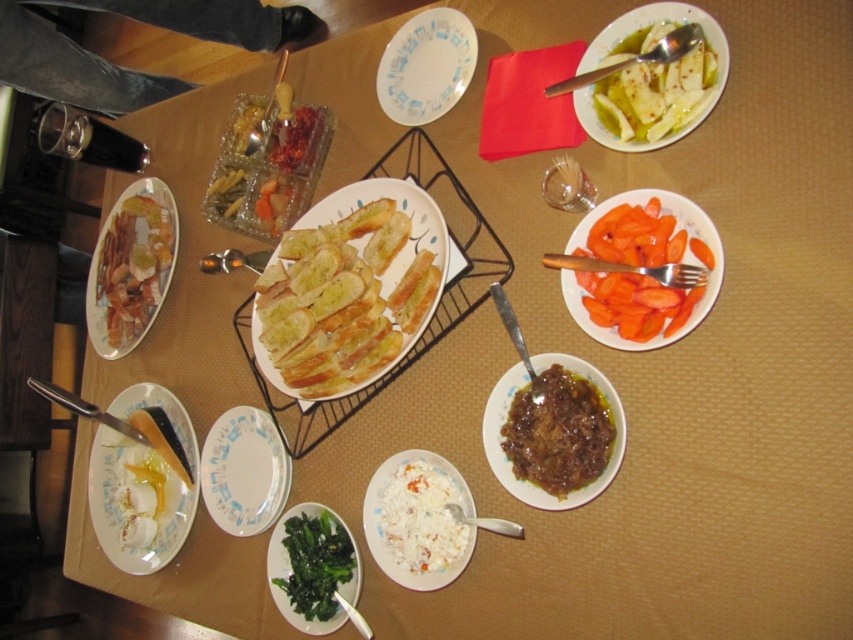
Is white matte rice bowl at center positioned behind white paper plate at lower left?

No.

Who is taller, white matte rice bowl at center or white paper plate at lower left?

white paper plate at lower left is taller.

Identify the location of white matte rice bowl at center. (418, 522).

Does point (318, 340) come behind point (579, 237)?

That is True.

Based on the photo, between golden crispy bread at center and sliced orange carrots at center right, which one has less height?

sliced orange carrots at center right is shorter.

The width and height of the screenshot is (853, 640). Identify the location of golden crispy bread at center. (349, 289).

This screenshot has width=853, height=640. What do you see at coordinates (641, 264) in the screenshot? I see `sliced orange carrots at center right` at bounding box center [641, 264].

Can you confirm if sliced orange carrots at center right is wider than white paper plate at lower left?

Incorrect, sliced orange carrots at center right's width does not surpass white paper plate at lower left's.

Does point (656, 227) lie behind point (264, 518)?

No, it is in front of (264, 518).

Locate an element on the screen. Image resolution: width=853 pixels, height=640 pixels. sliced orange carrots at center right is located at coordinates (641, 264).